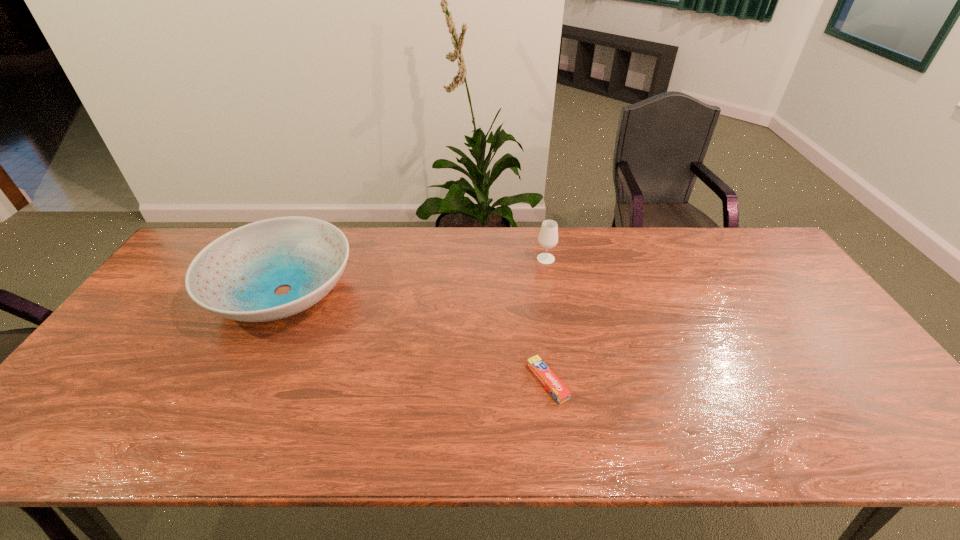
You are a GUI agent. You are given a task and a screenshot of the screen. Output one action in this format:
    pyautogui.click(x=<x>, y=<y>)
    Task: Click on the glass
    
    Given the screenshot: What is the action you would take?
    pyautogui.click(x=548, y=237)

Locate an element on the screen. the leftmost object is located at coordinates (235, 276).

This screenshot has width=960, height=540. What are the coordinates of `the shortest object` in the screenshot? It's located at (557, 389).

At what (x,y) coordinates should I click in order to perform the action: click on toothpaste. Please return your answer as a coordinate pair (x, y). Looking at the image, I should click on (557, 389).

Find the location of a particular element. The width and height of the screenshot is (960, 540). blank area located on the left of the glass is located at coordinates (484, 259).

Locate an element on the screen. vacant space located on the front of the leftmost object is located at coordinates (224, 410).

This screenshot has height=540, width=960. I want to click on free spot located on the back of the nearest object, so click(x=536, y=292).

You are a GUI agent. You are given a task and a screenshot of the screen. Output one action in this format:
    pyautogui.click(x=<x>, y=<y>)
    Task: Click on the glass that is at the far edge
    
    Given the screenshot: What is the action you would take?
    pyautogui.click(x=548, y=237)

Where is `dish present at the far edge`? This screenshot has height=540, width=960. dish present at the far edge is located at coordinates tap(235, 276).

The image size is (960, 540). I want to click on object that is positioned at the left edge, so click(x=235, y=276).